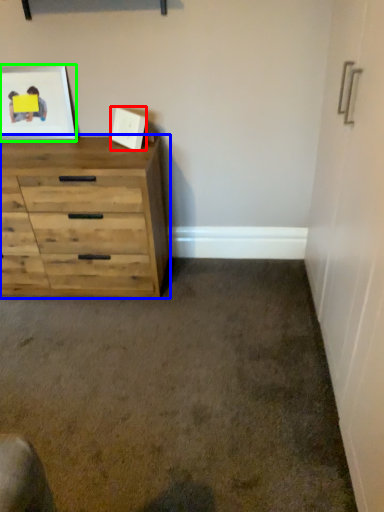
Question: Which object is positioned closest to picture frame (highlighted by a red box)? Select from chest of drawers (highlighted by a blue box) and picture frame (highlighted by a green box).

Choices:
 (A) chest of drawers
 (B) picture frame

Answer: (B)